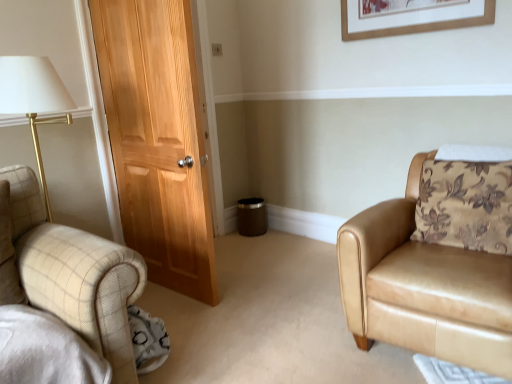
Find the location of a particular element. The height and width of the screenshot is (384, 512). tan leather armchair at right is located at coordinates (424, 288).

Describe the element at coordinates (424, 288) in the screenshot. The height and width of the screenshot is (384, 512). I see `tan leather armchair at right` at that location.

This screenshot has height=384, width=512. In order to click on wooden picture frame at upper center in this screenshot , I will do `click(418, 22)`.

What is the approximate width of wooden picture frame at upper center?

It is 2.08 inches.

This screenshot has height=384, width=512. What do you see at coordinates (418, 22) in the screenshot? I see `wooden picture frame at upper center` at bounding box center [418, 22].

The height and width of the screenshot is (384, 512). What are the coordinates of `tan leather armchair at right` in the screenshot? It's located at (424, 288).

Does tan leather armchair at right appear on the left side of wooden picture frame at upper center?

In fact, tan leather armchair at right is to the right of wooden picture frame at upper center.

Does tan leather armchair at right come in front of wooden picture frame at upper center?

Yes, the depth of tan leather armchair at right is less than that of wooden picture frame at upper center.

Which point is more forward, (421, 347) or (465, 23)?

The point (421, 347) is more forward.

Looking at this image, from the image's perspective, which object appears higher, tan leather armchair at right or wooden picture frame at upper center?

wooden picture frame at upper center.

From a real-world perspective, relative to wooden picture frame at upper center, is tan leather armchair at right vertically above or below?

Clearly, from a real-world perspective, tan leather armchair at right is below wooden picture frame at upper center.

Considering the sizes of objects tan leather armchair at right and wooden picture frame at upper center in the image provided, who is wider, tan leather armchair at right or wooden picture frame at upper center?

tan leather armchair at right.

Can you confirm if tan leather armchair at right is taller than wooden picture frame at upper center?

Yes.

Between tan leather armchair at right and wooden picture frame at upper center, which one has smaller size?

wooden picture frame at upper center is smaller.

Is tan leather armchair at right completely or partially outside of wooden picture frame at upper center?

Yes, tan leather armchair at right is outside of wooden picture frame at upper center.

Is tan leather armchair at right next to wooden picture frame at upper center?

No, tan leather armchair at right is not in contact with wooden picture frame at upper center.

Is tan leather armchair at right positioned with its back to wooden picture frame at upper center?

tan leather armchair at right is not turned away from wooden picture frame at upper center.

How far apart are tan leather armchair at right and wooden picture frame at upper center?

The distance of tan leather armchair at right from wooden picture frame at upper center is 4.25 feet.

What are the coordinates of `chair below the wooden picture frame at upper center (from a real-world perspective)` in the screenshot? It's located at (424, 288).

Does wooden picture frame at upper center appear on the left side of tan leather armchair at right?

Yes.

Relative to tan leather armchair at right, is wooden picture frame at upper center in front or behind?

wooden picture frame at upper center is behind tan leather armchair at right.

Does point (424, 19) lie in front of point (357, 330)?

No.

From the image's perspective, which is above, wooden picture frame at upper center or tan leather armchair at right?

wooden picture frame at upper center, from the image's perspective.

From a real-world perspective, does wooden picture frame at upper center sit lower than tan leather armchair at right?

No, from a real-world perspective, wooden picture frame at upper center is not under tan leather armchair at right.

Which of these two, wooden picture frame at upper center or tan leather armchair at right, is wider?

tan leather armchair at right.

In terms of height, does wooden picture frame at upper center look taller or shorter compared to tan leather armchair at right?

In the image, wooden picture frame at upper center appears to be shorter than tan leather armchair at right.

Is wooden picture frame at upper center bigger than tan leather armchair at right?

Incorrect, wooden picture frame at upper center is not larger than tan leather armchair at right.

Can we say wooden picture frame at upper center lies outside tan leather armchair at right?

Absolutely, wooden picture frame at upper center is external to tan leather armchair at right.

In the scene shown: Are wooden picture frame at upper center and tan leather armchair at right making contact?

They are not placed beside each other.

Is tan leather armchair at right at the back of wooden picture frame at upper center?

No, tan leather armchair at right is not at the back of wooden picture frame at upper center.

Can you tell me how much wooden picture frame at upper center and tan leather armchair at right differ in facing direction?

The angle between the facing direction of wooden picture frame at upper center and the facing direction of tan leather armchair at right is 5.51 degrees.

Locate an element on the screen. Image resolution: width=512 pixels, height=384 pixels. picture frame above the tan leather armchair at right (from the image's perspective) is located at coordinates (418, 22).

You are a GUI agent. You are given a task and a screenshot of the screen. Output one action in this format:
    pyautogui.click(x=<x>, y=<y>)
    Task: Click on the picture frame on the left of tan leather armchair at right
    
    Given the screenshot: What is the action you would take?
    (418, 22)

Locate an element on the screen. The height and width of the screenshot is (384, 512). picture frame that is behind the tan leather armchair at right is located at coordinates (418, 22).